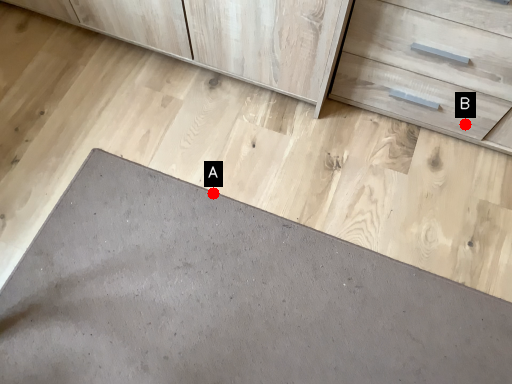
Question: Two points are circled on the image, labeled by A and B beside each circle. Which point is closer to the camera?

Choices:
 (A) A is closer
 (B) B is closer

Answer: (A)